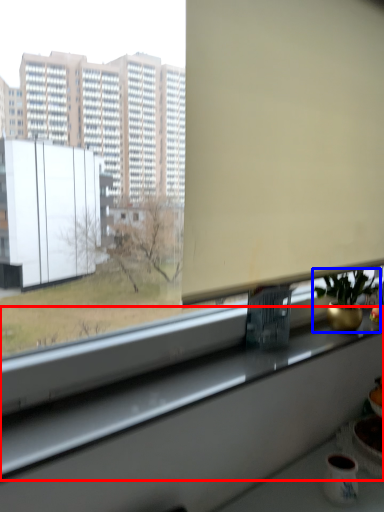
Question: Among these objects, which one is nearest to the camera, window sill (highlighted by a red box) or houseplant (highlighted by a blue box)?

Choices:
 (A) window sill
 (B) houseplant

Answer: (A)